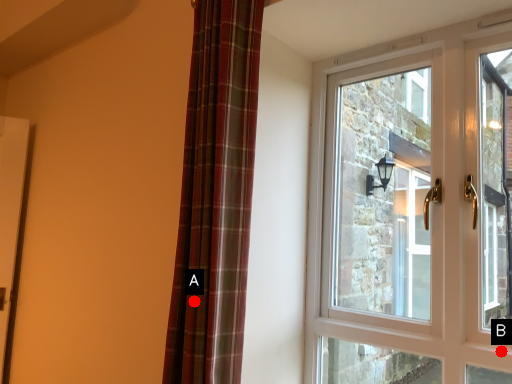
Question: Two points are circled on the image, labeled by A and B beside each circle. Which point is further to the camera?

Choices:
 (A) A is further
 (B) B is further

Answer: (B)